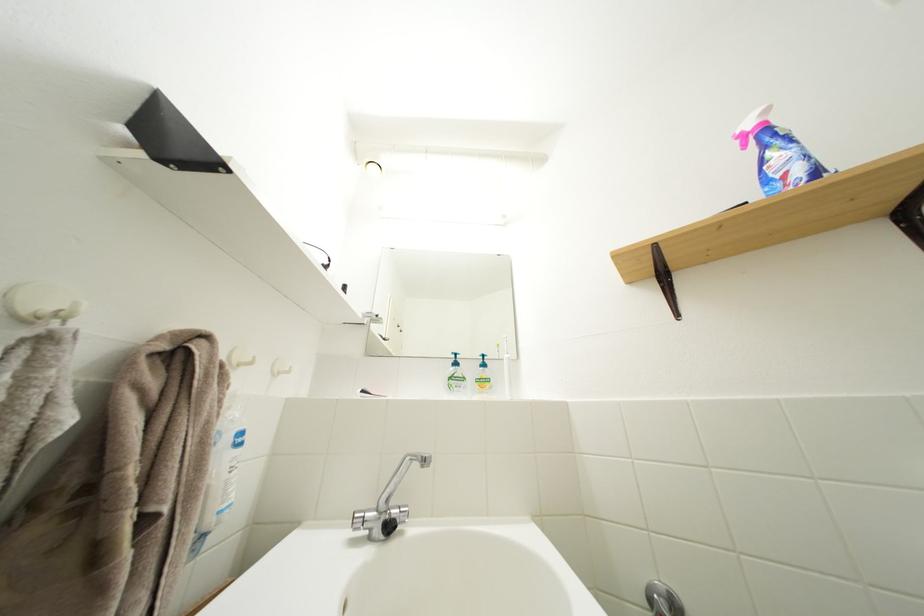
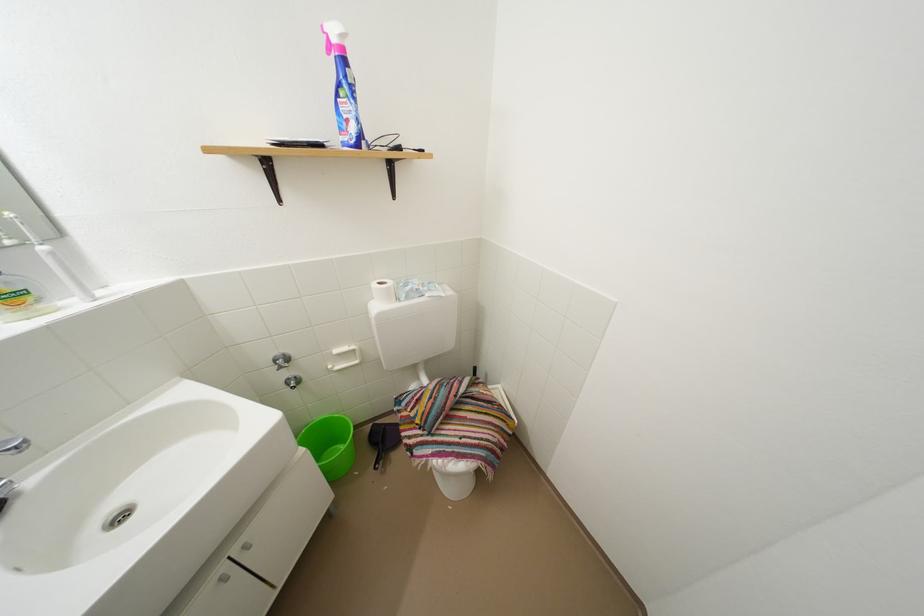
How did the camera likely rotate?

The camera rotated toward right-down.